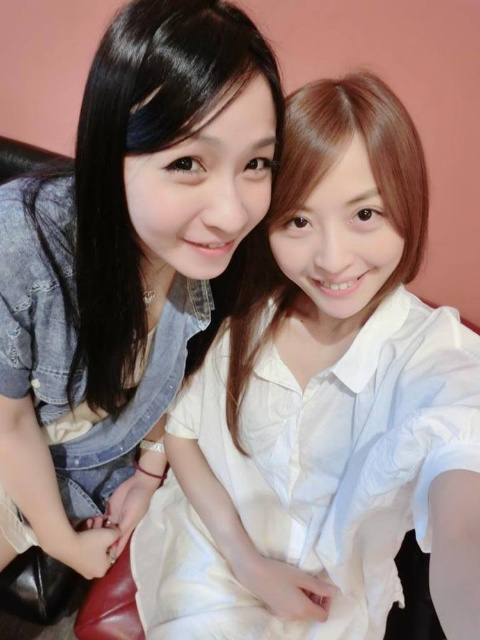
Between white cotton shirt at center and denim jacket at left, which one has more height?

white cotton shirt at center is taller.

Which is behind, point (376, 157) or point (99, 541)?

Point (99, 541)

This screenshot has width=480, height=640. In order to click on white cotton shirt at center in this screenshot , I will do `click(324, 410)`.

Does white cotton shirt at center have a smaller size compared to white glossy shirt at center?

Actually, white cotton shirt at center might be larger than white glossy shirt at center.

How far apart are white cotton shirt at center and white glossy shirt at center?

white cotton shirt at center and white glossy shirt at center are 3.61 inches apart from each other.

Is point (358, 83) farther from camera compared to point (261, 227)?

That is False.

Locate an element on the screen. This screenshot has width=480, height=640. white cotton shirt at center is located at coordinates click(324, 410).

Who is lower down, denim jacket at left or white glossy shirt at center?

denim jacket at left is below.

Does point (34, 284) lie in front of point (276, 173)?

That is False.

The height and width of the screenshot is (640, 480). I want to click on denim jacket at left, so click(x=128, y=260).